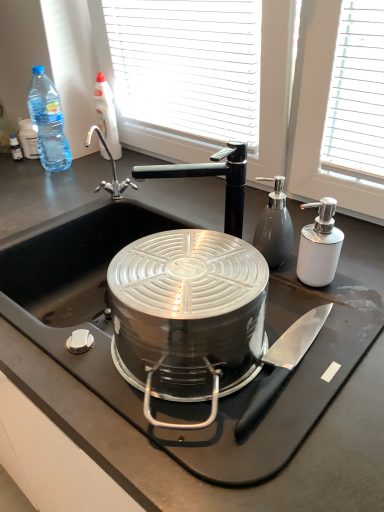
Find the location of `vacant space to the left of clear plastic bottle at upper left, which ranks as the 1th bottle in back-to-front order`. vacant space to the left of clear plastic bottle at upper left, which ranks as the 1th bottle in back-to-front order is located at coordinates (71, 158).